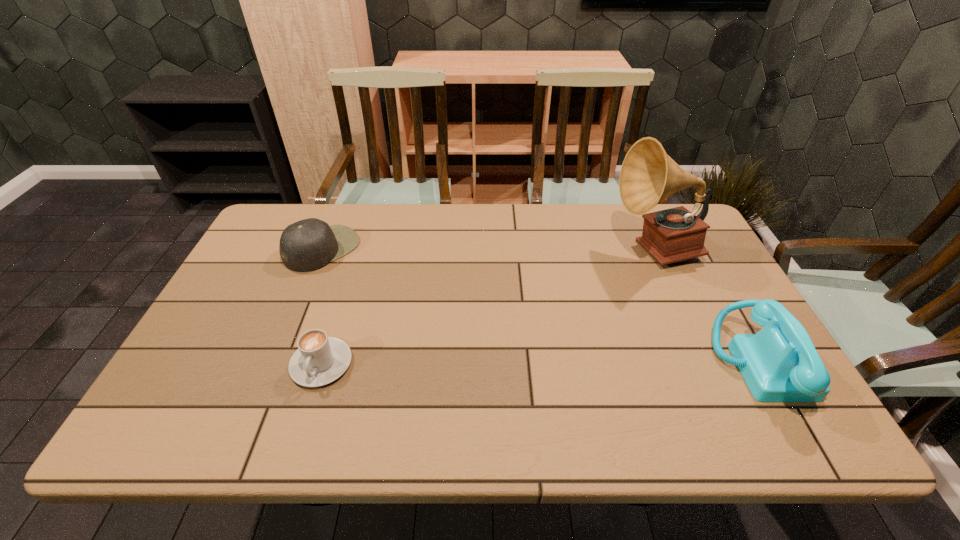
Where is `phonograph record that is at the far edge`? This screenshot has height=540, width=960. phonograph record that is at the far edge is located at coordinates (648, 175).

Where is `cap positioned at the far edge`? The width and height of the screenshot is (960, 540). cap positioned at the far edge is located at coordinates (307, 245).

Locate an element on the screen. cappuccino that is at the near edge is located at coordinates (319, 360).

Locate an element on the screen. This screenshot has height=540, width=960. telephone at the near edge is located at coordinates (780, 363).

Find the location of `object that is at the left edge`. object that is at the left edge is located at coordinates (307, 245).

At what (x,y) coordinates should I click in order to perform the action: click on telephone located in the right edge section of the desktop. Please return your answer as a coordinate pair (x, y). The width and height of the screenshot is (960, 540). Looking at the image, I should click on (780, 363).

Identify the location of phonograph record that is positioned at the right edge. The image size is (960, 540). (648, 175).

Locate an element on the screen. object at the far left corner is located at coordinates (307, 245).

The height and width of the screenshot is (540, 960). Find the location of `object present at the far right corner`. object present at the far right corner is located at coordinates (648, 175).

Where is `object at the near right corner`? This screenshot has width=960, height=540. object at the near right corner is located at coordinates (780, 363).